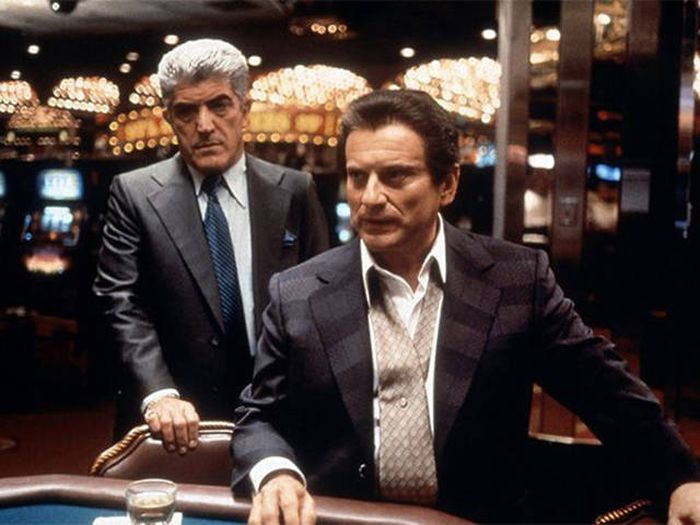
The height and width of the screenshot is (525, 700). I want to click on card table, so click(x=76, y=488).